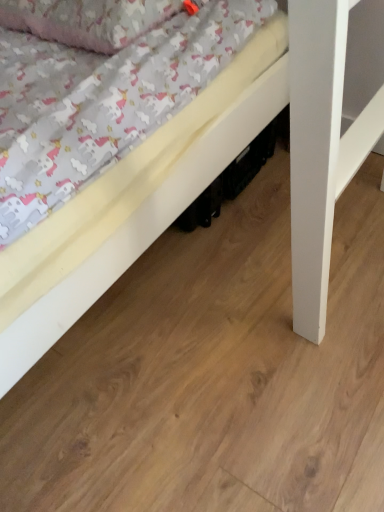
Question: From a real-world perspective, is fluffy cotton pillow at upper left positioned over white matte bed at lower left based on gravity?

Choices:
 (A) no
 (B) yes

Answer: (B)

Question: Is fluffy cotton pillow at upper left thinner than white matte bed at lower left?

Choices:
 (A) no
 (B) yes

Answer: (B)

Question: Is fluffy cotton pillow at upper left at the right side of white matte bed at lower left?

Choices:
 (A) no
 (B) yes

Answer: (A)

Question: Considering the relative sizes of fluffy cotton pillow at upper left and white matte bed at lower left in the image provided, is fluffy cotton pillow at upper left smaller than white matte bed at lower left?

Choices:
 (A) no
 (B) yes

Answer: (B)

Question: From the image's perspective, does fluffy cotton pillow at upper left appear lower than white matte bed at lower left?

Choices:
 (A) no
 (B) yes

Answer: (A)

Question: From a real-world perspective, is fluffy cotton pillow at upper left below white matte bed at lower left?

Choices:
 (A) no
 (B) yes

Answer: (A)

Question: From the image's perspective, does white matte bed at lower left appear lower than fluffy cotton pillow at upper left?

Choices:
 (A) no
 (B) yes

Answer: (B)

Question: Is white matte bed at lower left to the left of fluffy cotton pillow at upper left from the viewer's perspective?

Choices:
 (A) no
 (B) yes

Answer: (A)

Question: Is white matte bed at lower left at the right side of fluffy cotton pillow at upper left?

Choices:
 (A) no
 (B) yes

Answer: (B)

Question: Is white matte bed at lower left positioned with its back to fluffy cotton pillow at upper left?

Choices:
 (A) yes
 (B) no

Answer: (B)

Question: Is white matte bed at lower left positioned behind fluffy cotton pillow at upper left?

Choices:
 (A) yes
 (B) no

Answer: (B)

Question: Can you confirm if white matte bed at lower left is shorter than fluffy cotton pillow at upper left?

Choices:
 (A) yes
 (B) no

Answer: (A)

Question: Is fluffy cotton pillow at upper left spatially inside white matte bed at lower left, or outside of it?

Choices:
 (A) inside
 (B) outside

Answer: (B)